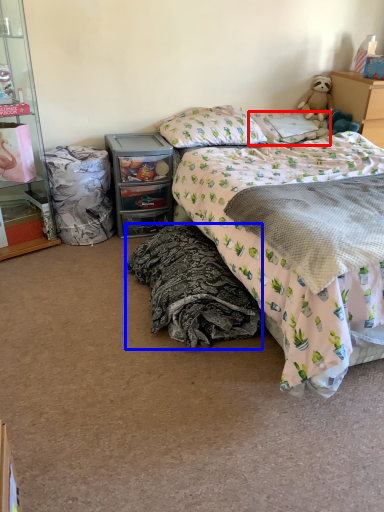
Question: Which point is closer to the camera, pillow (highlighted by a red box) or blanket (highlighted by a blue box)?

Choices:
 (A) pillow
 (B) blanket

Answer: (B)